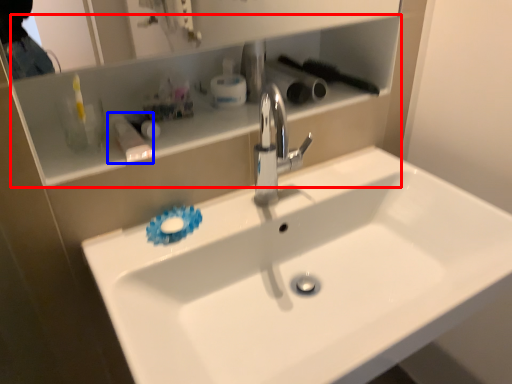
Question: Which object appears closest to the camera in this image, cabinet (highlighted by a red box) or toiletry (highlighted by a blue box)?

Choices:
 (A) cabinet
 (B) toiletry

Answer: (A)